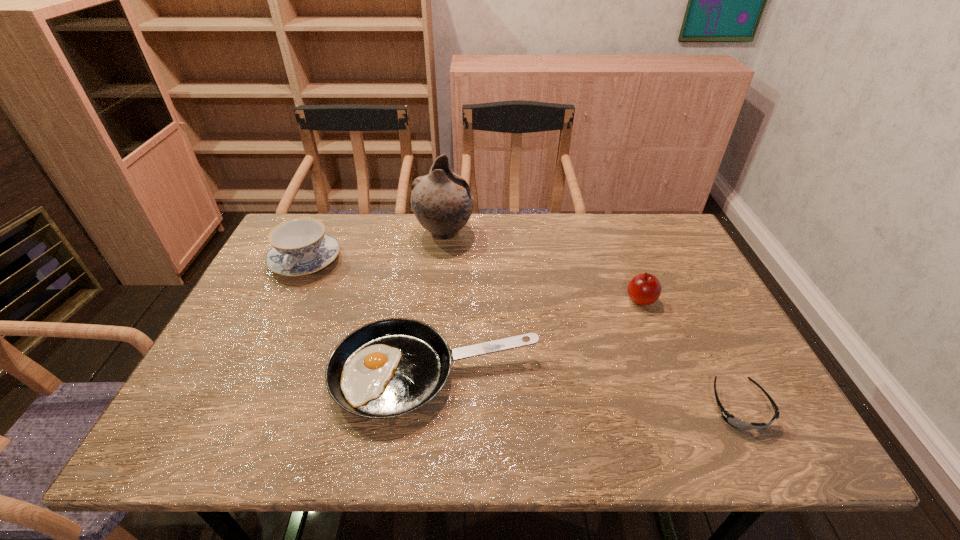
In order to click on the tallest object in this screenshot , I will do `click(442, 201)`.

Where is `chinaware`? The image size is (960, 540). chinaware is located at coordinates (300, 246).

The height and width of the screenshot is (540, 960). Identify the location of the second object from right to left. pyautogui.click(x=644, y=289).

Find the location of `the third nearest object`. the third nearest object is located at coordinates (644, 289).

You are a GUI agent. You are given a task and a screenshot of the screen. Output one action in this format:
    pyautogui.click(x=<x>, y=<y>)
    Task: Click on the frying pan
    The image size is (960, 540).
    Given the screenshot: What is the action you would take?
    pyautogui.click(x=388, y=368)

The width and height of the screenshot is (960, 540). I want to click on sunglasses, so click(730, 419).

The height and width of the screenshot is (540, 960). I want to click on the rightmost object, so click(x=730, y=419).

You are a GUI agent. You are given a task and a screenshot of the screen. Output one action in this format:
    pyautogui.click(x=<x>, y=<y>)
    Task: Click on the free region located 0.340m from the spout of the tallest object
    The width and height of the screenshot is (960, 540).
    Given the screenshot: What is the action you would take?
    pyautogui.click(x=581, y=233)

At what (x,y) coordinates should I click in order to perform the action: click on vacant space situated with the handle on the side of the chinaware. Please return your answer as a coordinate pair (x, y). This screenshot has height=540, width=960. Looking at the image, I should click on (248, 382).

Locate an element on the screen. free region located on the front of the third nearest object is located at coordinates (663, 356).